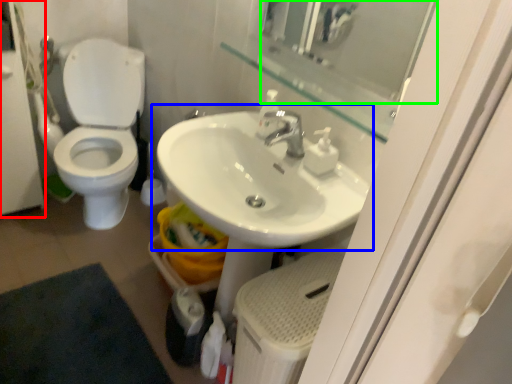
Question: Considering the real-world distances, which object is farthest from screen door (highlighted by a red box)? sink (highlighted by a blue box) or mirror (highlighted by a green box)?

Choices:
 (A) sink
 (B) mirror

Answer: (B)